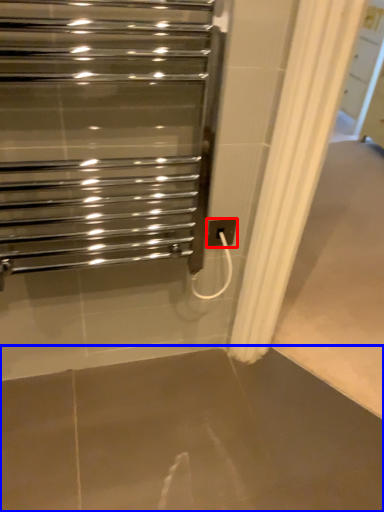
Question: Which point is further to the camera, electric outlet (highlighted by a red box) or concrete (highlighted by a blue box)?

Choices:
 (A) electric outlet
 (B) concrete

Answer: (A)